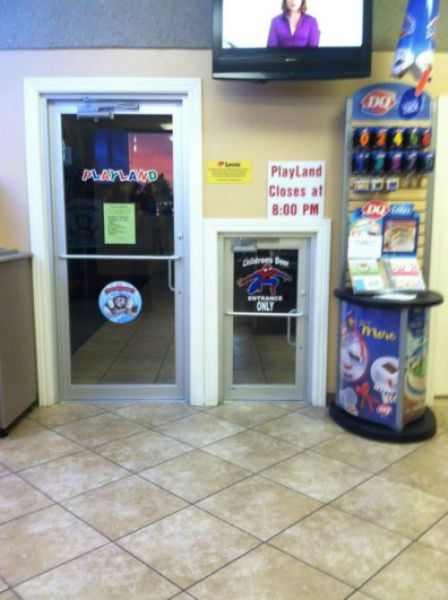
Locate an element on the screen. door bar is located at coordinates (112, 257), (262, 312).